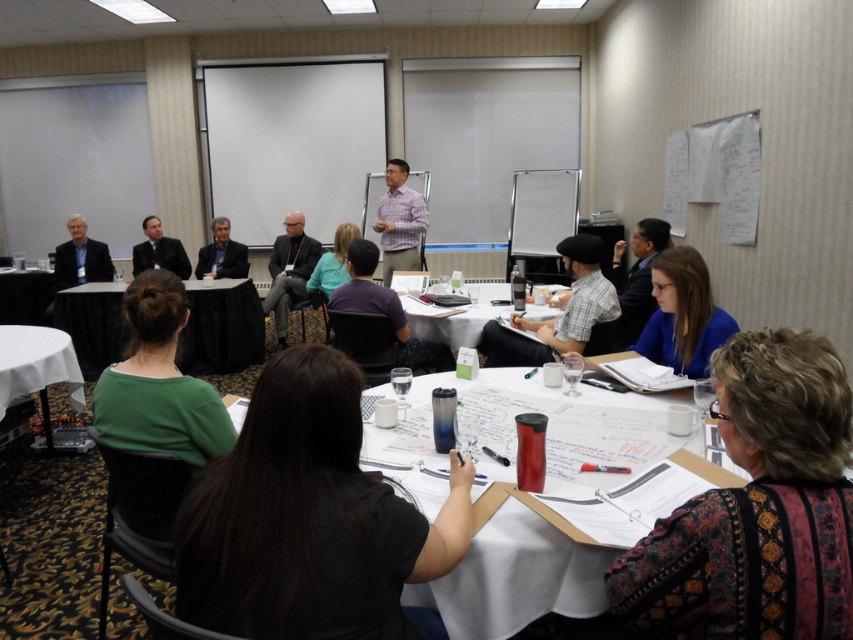
You are a photographer positioned at the back of the conference room. You need to capture a clear photo of both the plaid shirt at center and the matte black suit at center. Which of the two should you focus on first to ensure both are in focus?

The plaid shirt at center is taller than the matte black suit at center. Since the photographer is at the back, focusing on the taller plaid shirt at center first will ensure the matte black suit at center remains in focus as it is closer to the camera.

You are organizing a presentation and need to place a name tag on the table. The name tag is the same size as the matte teal shirt at center. Will the black matte water bottle at lower center fit on the table without overlapping the name tag?

The black matte water bottle at lower center is larger than the matte teal shirt at center. Since the name tag is the same size as the matte teal shirt at center, the water bottle will require more space, so there might not be enough room if placed next to the name tag without overlapping.